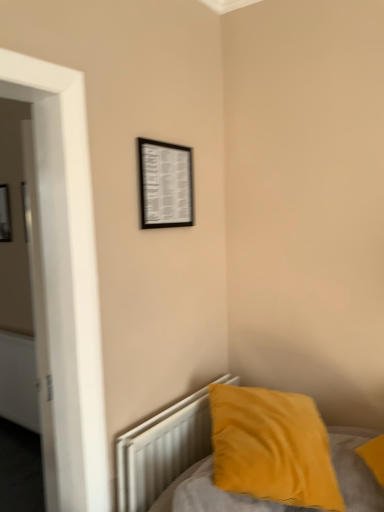
Question: Choose the correct answer: Is velvet yellow pillow at lower right inside black matte picture frame at upper center, the 1th picture frame in the front-to-back sequence, or outside it?

Choices:
 (A) inside
 (B) outside

Answer: (B)

Question: From the image's perspective, relative to black matte picture frame at upper center, acting as the first picture frame starting from the right, is velvet yellow pillow at lower right above or below?

Choices:
 (A) below
 (B) above

Answer: (A)

Question: Estimate the real-world distances between objects in this image. Which object is closer to the white metallic radiator at lower right?

Choices:
 (A) velvet yellow pillow at lower right
 (B) black matte picture frame at upper left, which is the 1th picture frame in back-to-front order
 (C) black matte picture frame at upper center, acting as the second picture frame starting from the left
 (D) velvet yellow pillow at lower right

Answer: (A)

Question: Estimate the real-world distances between objects in this image. Which object is farther from the velvet yellow pillow at lower right?

Choices:
 (A) black matte picture frame at upper center, which ranks as the second picture frame in back-to-front order
 (B) velvet yellow pillow at lower right
 (C) white metallic radiator at lower right
 (D) black matte picture frame at upper left, the second picture frame in the right-to-left sequence

Answer: (D)